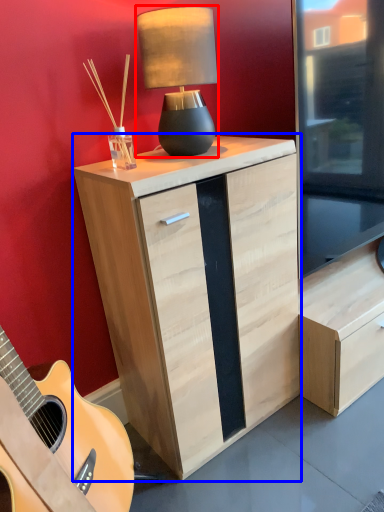
Question: Which object appears farthest to the camera in this image, lamp (highlighted by a red box) or chest of drawers (highlighted by a blue box)?

Choices:
 (A) lamp
 (B) chest of drawers

Answer: (A)